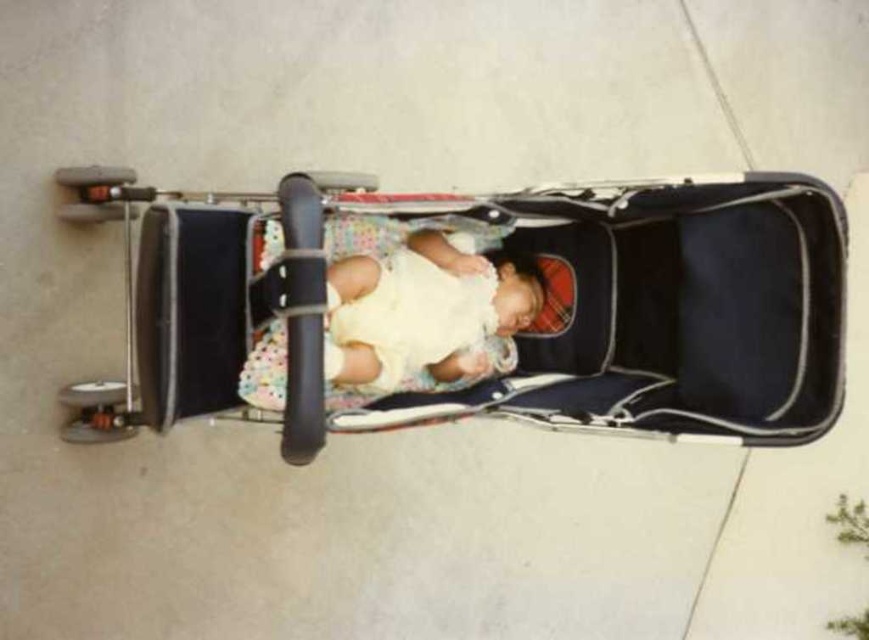
You are a parent trying to fit both the black fabric baby carriage at center and the soft yellow fabric baby at center into the trunk of your car. The trunk has a limited space. Based on their sizes, which one should you place first to maximize space efficiency?

The black fabric baby carriage at center is larger in size than the soft yellow fabric baby at center, so you should place the black fabric baby carriage at center first to maximize space efficiency by fitting the larger item first.

You are a parent trying to move the soft yellow fabric baby at center into the black fabric baby carriage at center. Based on their positions, can you lift the baby and place them into the carriage without moving the carriage?

The black fabric baby carriage at center is located above the soft yellow fabric baby at center, so you can lift the baby and place them into the carriage without needing to move the carriage itself since the carriage is already positioned above the baby.

You are standing in front of the stroller and want to place a small toy on the point located at coordinates point (774, 396). If your hand is 6 feet away from the stroller, can you reach that point?

The point (774, 396) is 7.24 feet from the viewer. Since your hand is only 6 feet away from the stroller, you cannot reach the point as it is farther away than your current reach.